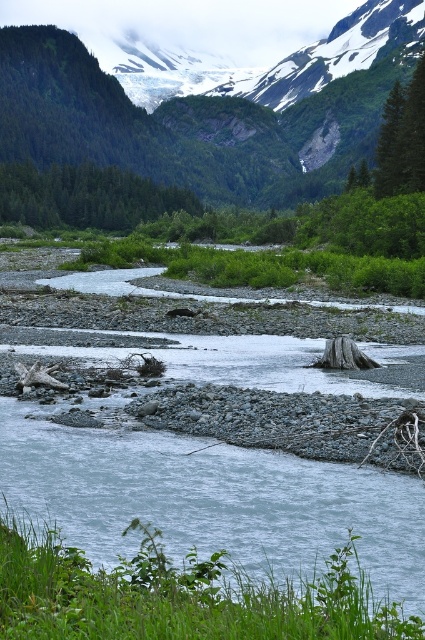
You are standing at the edge of the river and see the green forested mountain at upper center and the green matte tree at center. Which object is positioned to the right side of the other?

The green forested mountain at upper center is to the right of the green matte tree at center.

Looking at this image, you are hiking along the river and want to take a photo of both the green forested mountain at upper center and the green textured tree at upper right in the same frame. Based on their positions, which object should you position closer to the left side of your camera viewfinder?

The green forested mountain at upper center should be positioned closer to the left side of the camera viewfinder because it is located to the left of the green textured tree at upper right.

You are an explorer trying to determine the distance between the green forested mountain at upper center and the green textured tree at upper right. Based on the scene, can you tell which one is farther away from you?

The green textured tree at upper right is farther away because it is positioned behind the green forested mountain at upper center.